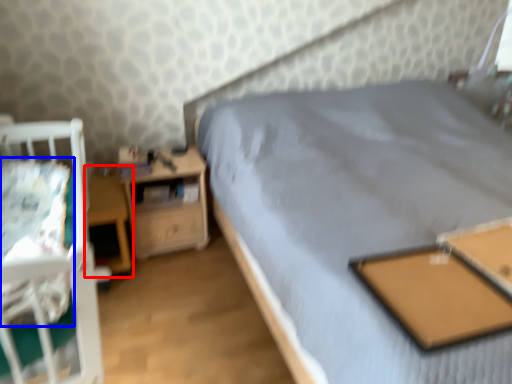
Question: Among these objects, which one is nearest to the camera, table (highlighted by a red box) or sheet (highlighted by a blue box)?

Choices:
 (A) table
 (B) sheet

Answer: (B)